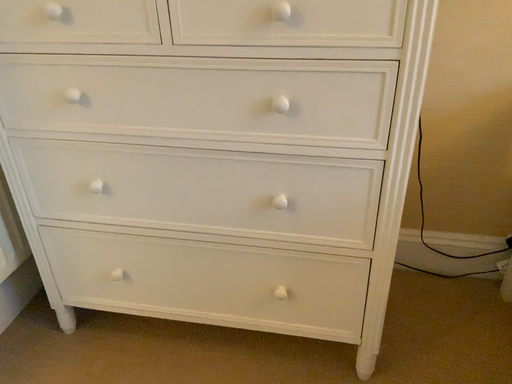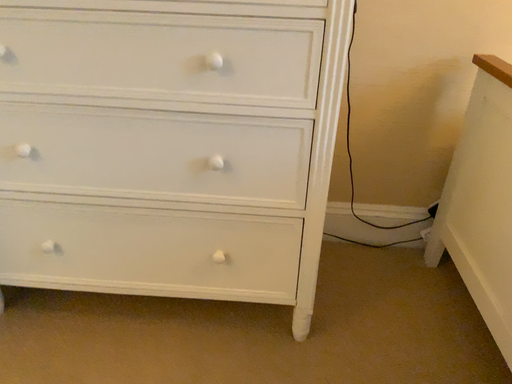
Question: Which way did the camera rotate in the video?

Choices:
 (A) rotated left
 (B) rotated right

Answer: (B)